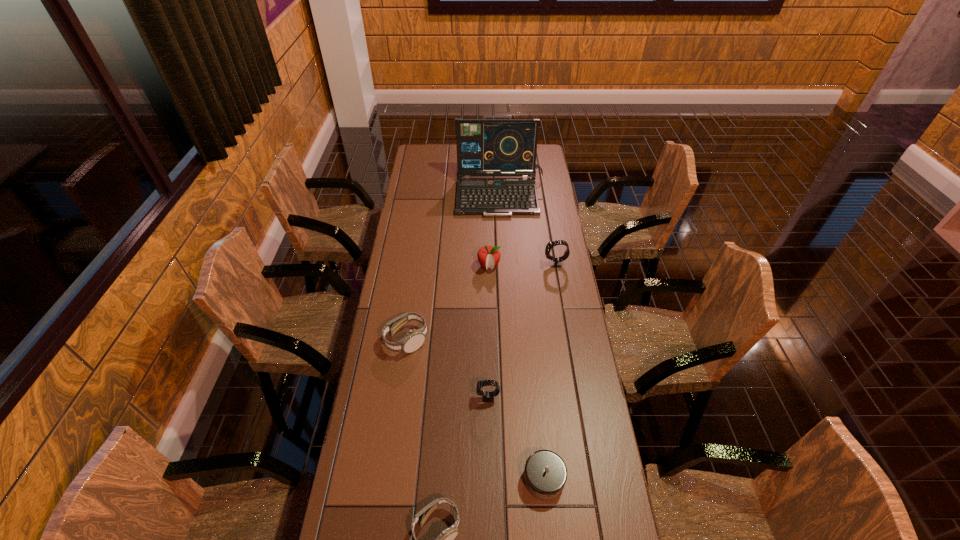
At what (x,y) coordinates should I click in order to perform the action: click on chocolate cake located at the right edge. Please return your answer as a coordinate pair (x, y). This screenshot has width=960, height=540. Looking at the image, I should click on (0, 0).

Find the location of `vacant area at the far edge`. vacant area at the far edge is located at coordinates (503, 150).

Image resolution: width=960 pixels, height=540 pixels. In the image, there is a desktop. Find the location of `vacant space at the far right corner`. vacant space at the far right corner is located at coordinates (533, 147).

At what (x,y) coordinates should I click in order to perform the action: click on empty space that is in between the farthest gray watch and the red apple. Please return your answer as a coordinate pair (x, y). Looking at the image, I should click on (491, 207).

At what (x,y) coordinates should I click in order to perform the action: click on free space between the second farthest object and the tallest watch. Please return your answer as a coordinate pair (x, y). Image resolution: width=960 pixels, height=540 pixels. Looking at the image, I should click on point(496,172).

Identify which object is located as the second nearest to the chocolate chocolate cake. Please provide its 2D coordinates. Your answer should be formatted as a tuple, i.e. [(x, y)], where the tuple contains the x and y coordinates of a point satisfying the conditions above.

[(0, 0)]

Point out which object is positioned as the fifth nearest to the nearest object. Please provide its 2D coordinates. Your answer should be formatted as a tuple, i.e. [(x, y)], where the tuple contains the x and y coordinates of a point satisfying the conditions above.

[(0, 0)]

This screenshot has width=960, height=540. What are the coordinates of `watch that is the third closest to the nearest object` in the screenshot? It's located at (0, 0).

Select which watch is the closest to the nearest object. Please provide its 2D coordinates. Your answer should be formatted as a tuple, i.e. [(x, y)], where the tuple contains the x and y coordinates of a point satisfying the conditions above.

[(0, 0)]

Locate an element on the screen. gray watch that is the second closest to the seventh shortest object is located at coordinates (x=0, y=0).